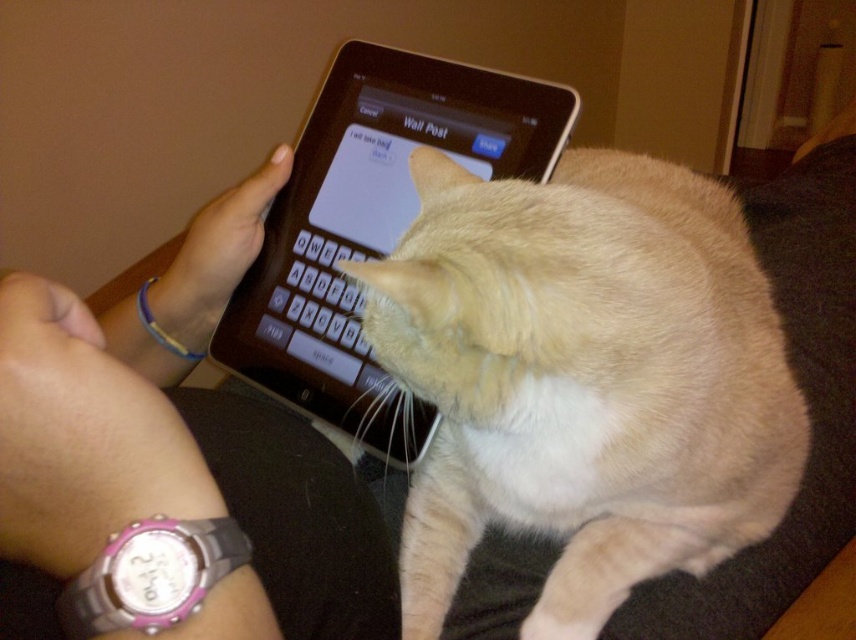
Question: Which point appears farthest from the camera in this image?

Choices:
 (A) (13, 316)
 (B) (406, 163)

Answer: (B)

Question: Does light brown fur cat at center appear on the right side of pink rubber watch at upper left?

Choices:
 (A) no
 (B) yes

Answer: (B)

Question: Does light brown fur cat at center appear under black glossy tablet at center?

Choices:
 (A) yes
 (B) no

Answer: (A)

Question: Can you confirm if light brown fur cat at center is positioned to the left of black glossy tablet at center?

Choices:
 (A) yes
 (B) no

Answer: (B)

Question: Among these points, which one is farthest from the camera?

Choices:
 (A) (450, 253)
 (B) (116, 612)

Answer: (A)

Question: Which point is closer to the camera?

Choices:
 (A) (519, 204)
 (B) (403, 132)
 (C) (218, 250)

Answer: (A)